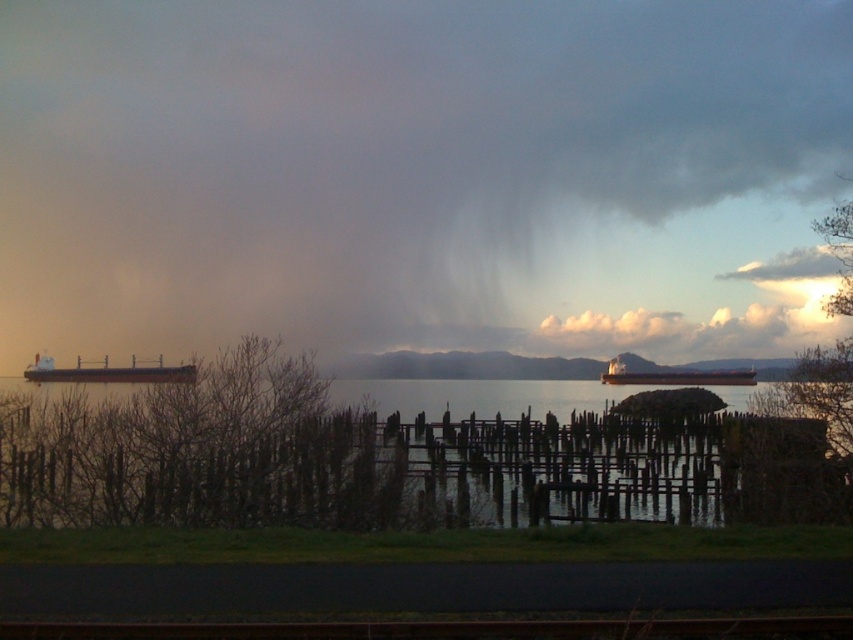
Question: Which point is farther to the camera?

Choices:
 (A) (705, 371)
 (B) (38, 364)

Answer: (A)

Question: Which is nearer to the transparent water at center?

Choices:
 (A) gray matte cloud at upper center
 (B) metallic gray ship at center
 (C) brown matte cargo ship at left

Answer: (B)

Question: Does gray matte cloud at upper center appear on the left side of transparent water at center?

Choices:
 (A) no
 (B) yes

Answer: (B)

Question: Does gray matte cloud at upper center appear on the right side of metallic gray ship at center?

Choices:
 (A) no
 (B) yes

Answer: (A)

Question: Can you confirm if transparent water at center is positioned to the right of metallic gray ship at center?

Choices:
 (A) yes
 (B) no

Answer: (B)

Question: Which is farther from the black metal train track at center?

Choices:
 (A) transparent water at center
 (B) brown matte cargo ship at left
 (C) gray matte cloud at upper center
 (D) metallic gray ship at center

Answer: (C)